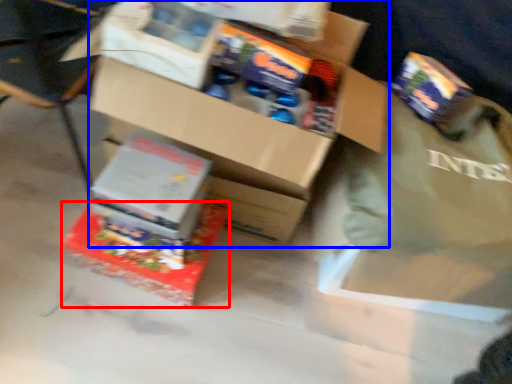
Question: Among these objects, which one is farthest to the camera, box (highlighted by a red box) or box (highlighted by a blue box)?

Choices:
 (A) box
 (B) box

Answer: (A)